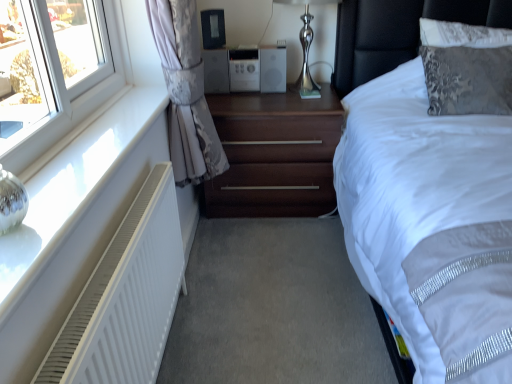
Find the location of `space that is in front of shiny metallic table lamp at upper center`. space that is in front of shiny metallic table lamp at upper center is located at coordinates (301, 106).